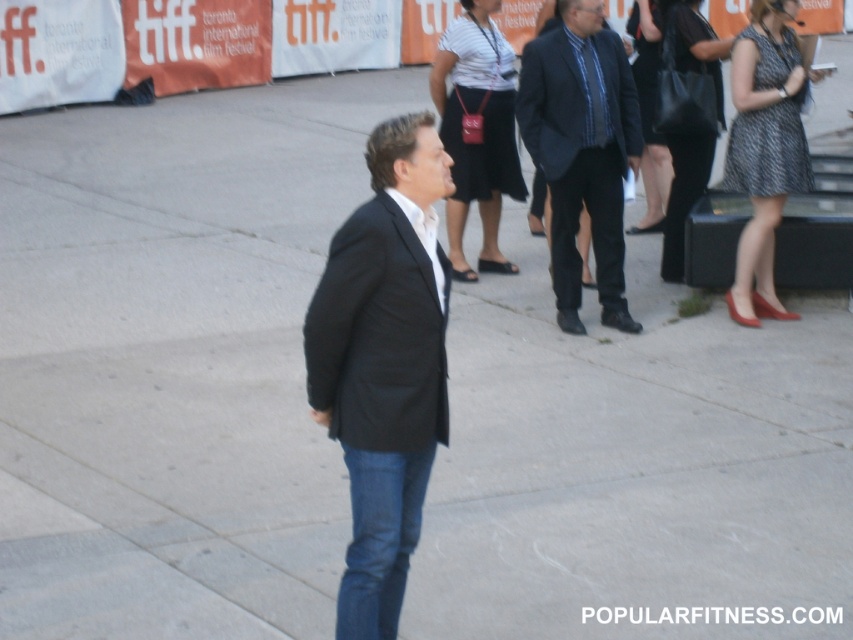
Can you confirm if white striped shirt at center is positioned above matte black dress at upper right?

Actually, white striped shirt at center is below matte black dress at upper right.

From the picture: Does white striped shirt at center have a smaller size compared to matte black dress at upper right?

Yes.

This screenshot has width=853, height=640. Find the location of `white striped shirt at center`. white striped shirt at center is located at coordinates (479, 132).

This screenshot has width=853, height=640. I want to click on white striped shirt at center, so click(479, 132).

In the scene shown: Does dark blue textured suit at center have a smaller size compared to white striped shirt at center?

Indeed, dark blue textured suit at center has a smaller size compared to white striped shirt at center.

Between dark blue textured suit at center and white striped shirt at center, which one appears on the left side from the viewer's perspective?

white striped shirt at center

What do you see at coordinates (582, 150) in the screenshot? Image resolution: width=853 pixels, height=640 pixels. I see `dark blue textured suit at center` at bounding box center [582, 150].

Locate an element on the screen. dark blue textured suit at center is located at coordinates (582, 150).

Is black matte suit at center positioned before matte black dress at upper right?

That is True.

Which is in front, point (343, 256) or point (630, 13)?

Point (343, 256) is in front.

Identify the location of black matte suit at center. (383, 364).